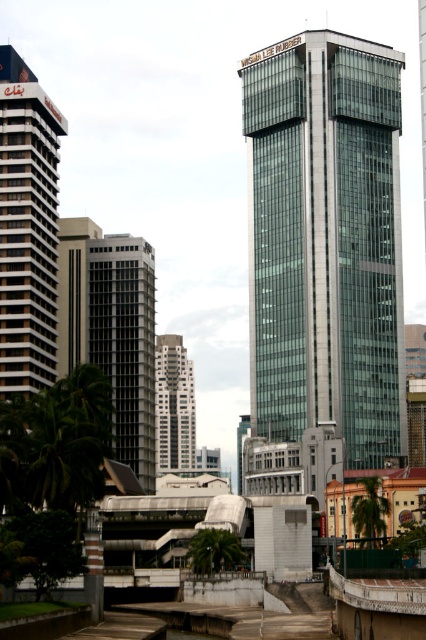
Can you confirm if dark gray concrete building at center is positioned above green leafy palm tree at center?

Yes.

Which is more to the left, dark gray concrete building at center or green leafy palm tree at center?

dark gray concrete building at center

Where is `dark gray concrete building at center`? This screenshot has width=426, height=640. dark gray concrete building at center is located at coordinates (112, 330).

Consider the image. Is green glass building at center further to camera compared to dark gray concrete building at center?

Yes, green glass building at center is behind dark gray concrete building at center.

Which is below, green glass building at center or dark gray concrete building at center?

dark gray concrete building at center

Is point (304, 285) positioned behind point (138, 323)?

Yes, it is.

This screenshot has width=426, height=640. I want to click on green glass building at center, so click(325, 241).

Does green glass building at center come behind green leafy palm tree at center?

Yes, it is.

Is green glass building at center below green leafy palm tree at center?

No.

Is point (373, 56) positioned before point (376, 486)?

No, (373, 56) is further to viewer.

In order to click on green glass building at center in this screenshot , I will do `click(325, 241)`.